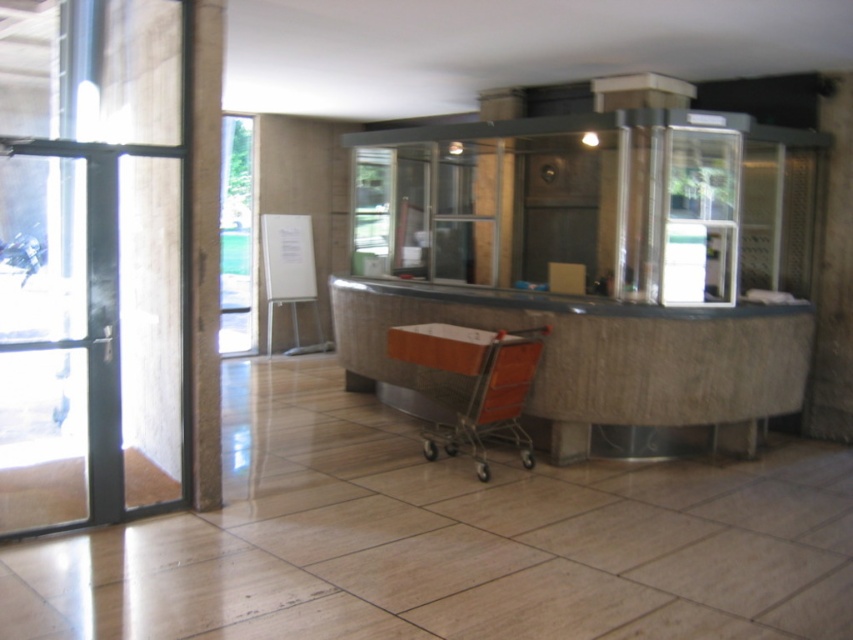
Is transparent glass door at left further to camera compared to wooden/metallic shopping cart at center?

No.

Does transparent glass door at left have a lesser width compared to wooden/metallic shopping cart at center?

No, transparent glass door at left is not thinner than wooden/metallic shopping cart at center.

This screenshot has height=640, width=853. I want to click on transparent glass door at left, so click(x=59, y=337).